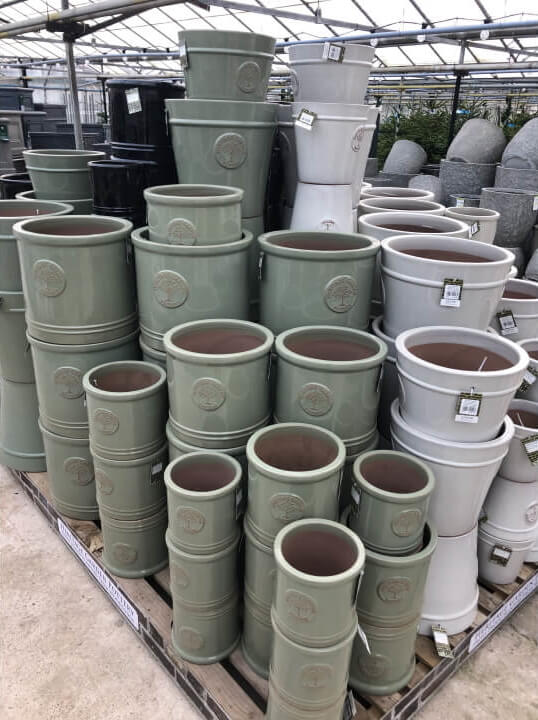
Locate an element on the screen. large green pot is located at coordinates coord(100,278).